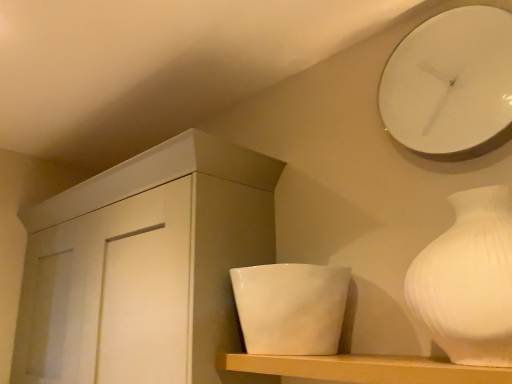
Question: Should I look upward or downward to see white matte vase at right?

Choices:
 (A) down
 (B) up

Answer: (A)

Question: Is white glossy clock at upper right at the right side of white matte vase at right?

Choices:
 (A) yes
 (B) no

Answer: (A)

Question: Would you say white matte vase at right is part of white glossy clock at upper right's contents?

Choices:
 (A) no
 (B) yes

Answer: (A)

Question: Is the depth of white glossy clock at upper right less than that of white matte vase at right?

Choices:
 (A) yes
 (B) no

Answer: (B)

Question: From a real-world perspective, is white glossy clock at upper right under white matte vase at right?

Choices:
 (A) yes
 (B) no

Answer: (B)

Question: Is white glossy clock at upper right positioned with its back to white matte vase at right?

Choices:
 (A) no
 (B) yes

Answer: (A)

Question: From the image's perspective, would you say white glossy clock at upper right is positioned over white matte vase at right?

Choices:
 (A) yes
 (B) no

Answer: (A)

Question: From a real-world perspective, does white matte shelf at center sit lower than white glossy bowl at center?

Choices:
 (A) no
 (B) yes

Answer: (B)

Question: Is white matte shelf at center far away from white glossy bowl at center?

Choices:
 (A) yes
 (B) no

Answer: (B)

Question: From a real-world perspective, is white matte shelf at center located higher than white glossy bowl at center?

Choices:
 (A) yes
 (B) no

Answer: (B)

Question: Is white matte shelf at center in front of white glossy bowl at center?

Choices:
 (A) no
 (B) yes

Answer: (B)

Question: Is white matte shelf at center next to white glossy bowl at center?

Choices:
 (A) yes
 (B) no

Answer: (B)

Question: Is white matte shelf at center smaller than white glossy bowl at center?

Choices:
 (A) no
 (B) yes

Answer: (B)

Question: Considering the relative positions of white glossy clock at upper right and white matte cabinet at center in the image provided, is white glossy clock at upper right to the left of white matte cabinet at center from the viewer's perspective?

Choices:
 (A) yes
 (B) no

Answer: (B)